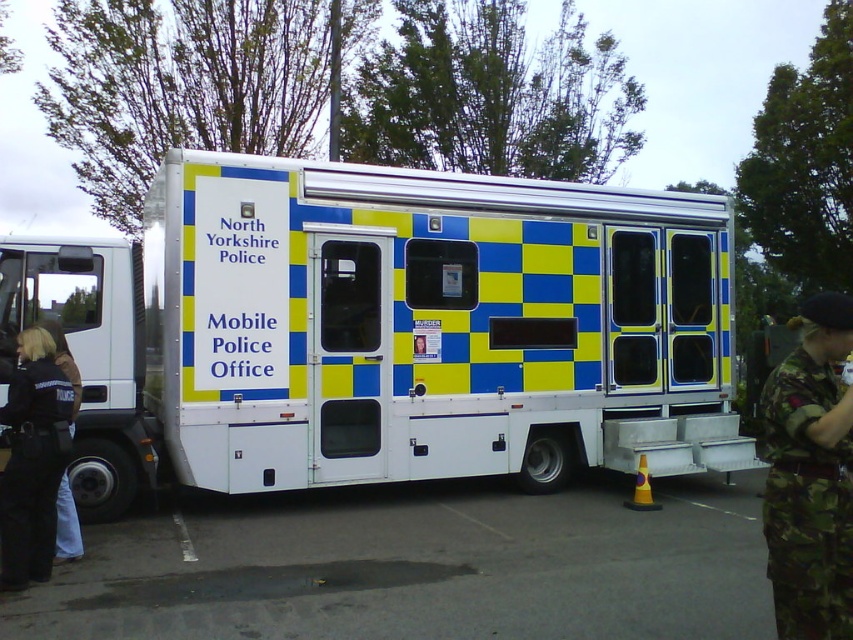
Between black uniform at lower left and black uniform at left, which one appears on the left side from the viewer's perspective?

black uniform at lower left is more to the left.

Who is more distant from viewer, [44,525] or [67,353]?

The point [67,353] is more distant.

You are a GUI agent. You are given a task and a screenshot of the screen. Output one action in this format:
    pyautogui.click(x=<x>, y=<y>)
    Task: Click on the black uniform at lower left
    Image resolution: width=853 pixels, height=640 pixels.
    Given the screenshot: What is the action you would take?
    pyautogui.click(x=32, y=460)

Based on the photo, which of these two, white plastic mobile police office at center or black uniform at lower left, stands shorter?

With less height is white plastic mobile police office at center.

Does white plastic mobile police office at center have a larger size compared to black uniform at lower left?

Incorrect, white plastic mobile police office at center is not larger than black uniform at lower left.

The image size is (853, 640). Describe the element at coordinates (387, 330) in the screenshot. I see `white plastic mobile police office at center` at that location.

This screenshot has height=640, width=853. Find the location of `white plastic mobile police office at center`. white plastic mobile police office at center is located at coordinates (387, 330).

Which is below, camouflage fabric uniform at right or black uniform at left?

Positioned lower is camouflage fabric uniform at right.

Who is taller, camouflage fabric uniform at right or black uniform at left?

black uniform at left is taller.

What do you see at coordinates (810, 476) in the screenshot? The height and width of the screenshot is (640, 853). I see `camouflage fabric uniform at right` at bounding box center [810, 476].

Identify the location of camouflage fabric uniform at right. (810, 476).